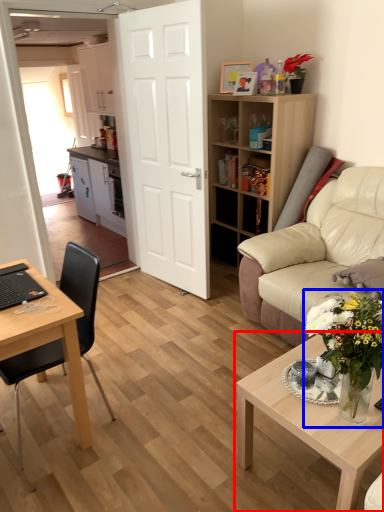
Question: Among these objects, which one is farthest to the camera, coffee table (highlighted by a red box) or houseplant (highlighted by a blue box)?

Choices:
 (A) coffee table
 (B) houseplant

Answer: (A)